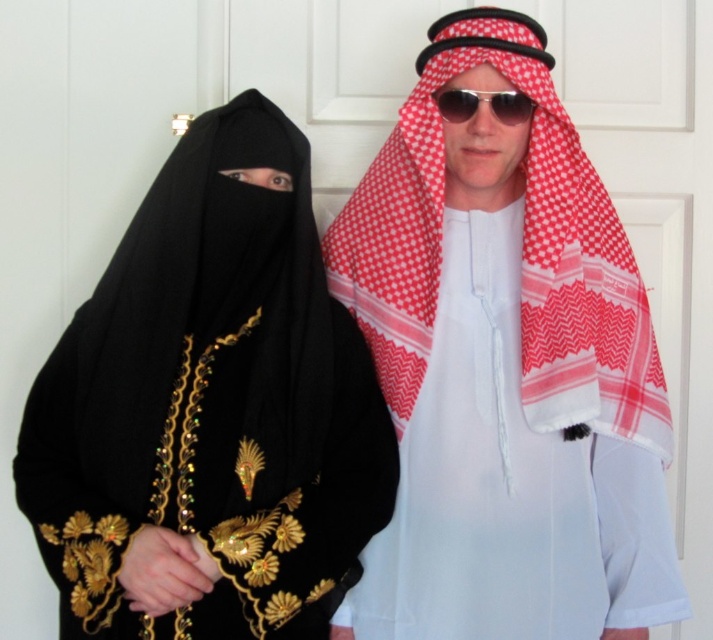
Which is more to the right, black velvet abaya at left or sunglasses at center?

sunglasses at center is more to the right.

Is point (251, 192) positioned after point (448, 102)?

No, (251, 192) is in front of (448, 102).

The image size is (713, 640). I want to click on black velvet abaya at left, so click(x=210, y=410).

Does black velvet abaya at left have a larger size compared to white woven keffiyeh at center?

Indeed, black velvet abaya at left has a larger size compared to white woven keffiyeh at center.

Between black velvet abaya at left and white woven keffiyeh at center, which one appears on the left side from the viewer's perspective?

black velvet abaya at left is more to the left.

Is point (120, 516) positioned behind point (478, 275)?

No, it is in front of (478, 275).

The image size is (713, 640). I want to click on black velvet abaya at left, so click(210, 410).

Who is more forward, (502, 481) or (540, 129)?

Positioned in front is point (502, 481).

Can you confirm if white woven keffiyeh at center is thinner than red checkered scarf at upper right?

Yes, white woven keffiyeh at center is thinner than red checkered scarf at upper right.

Where is `white woven keffiyeh at center`? white woven keffiyeh at center is located at coordinates (511, 483).